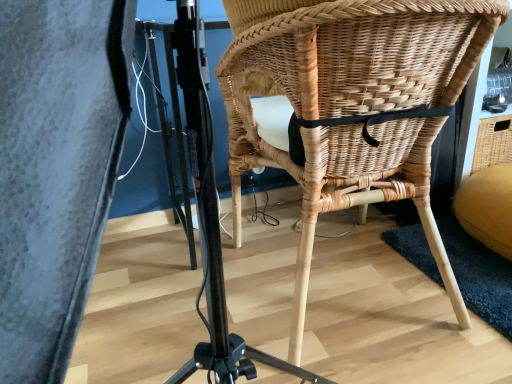
You are a GUI agent. You are given a task and a screenshot of the screen. Output one action in this format:
    pyautogui.click(x=<x>, y=<y>)
    Task: Click on the vacant space in natural wicker chair at center (from a real-world perspective)
    
    Given the screenshot: What is the action you would take?
    pyautogui.click(x=339, y=282)